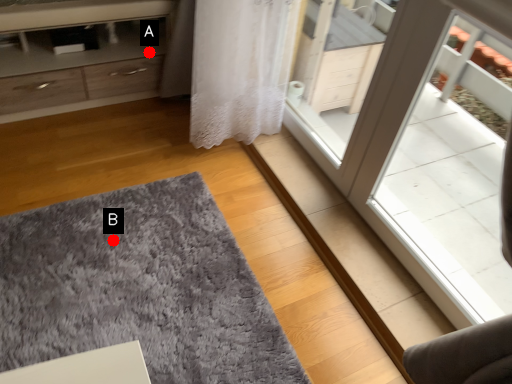
Question: Two points are circled on the image, labeled by A and B beside each circle. Which point is farther to the camera?

Choices:
 (A) A is further
 (B) B is further

Answer: (A)